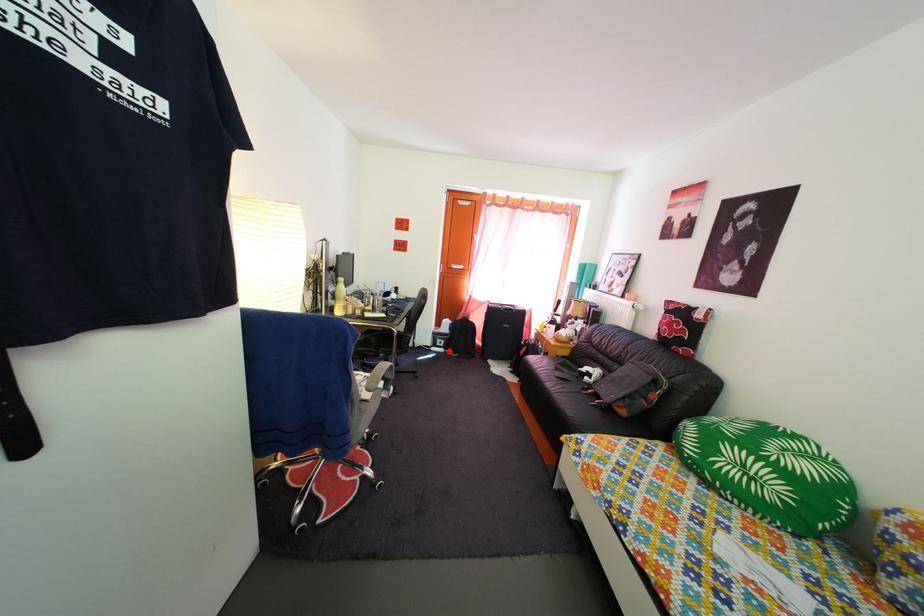
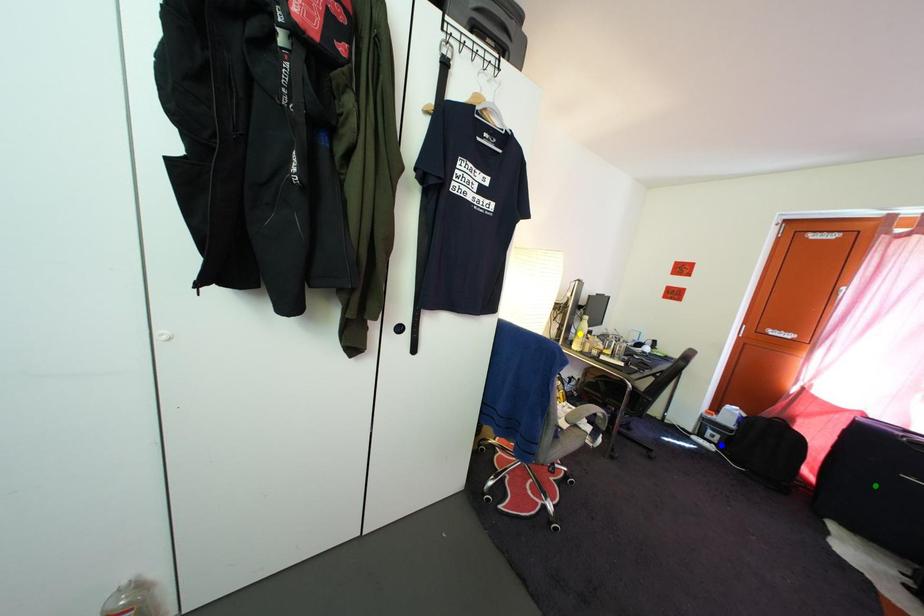
Question: I am providing you with two images of the same scene from different viewpoints. A red point is marked on the first image. You are given multiple points on the second image. Which point in image 2 represents the same 3d spot as the red point in image 1?

Choices:
 (A) blue point
 (B) yellow point
 (C) green point

Answer: (A)